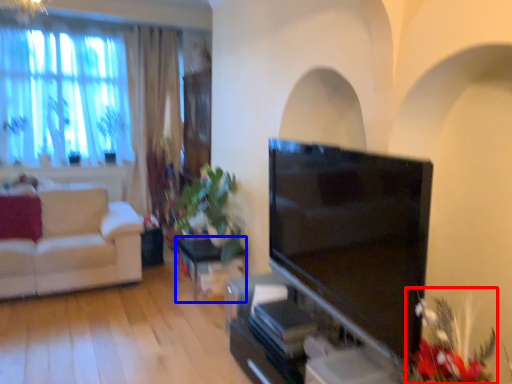
Question: Which of the following is the farthest to the observer, floral arrangement (highlighted by a red box) or table (highlighted by a blue box)?

Choices:
 (A) floral arrangement
 (B) table

Answer: (B)